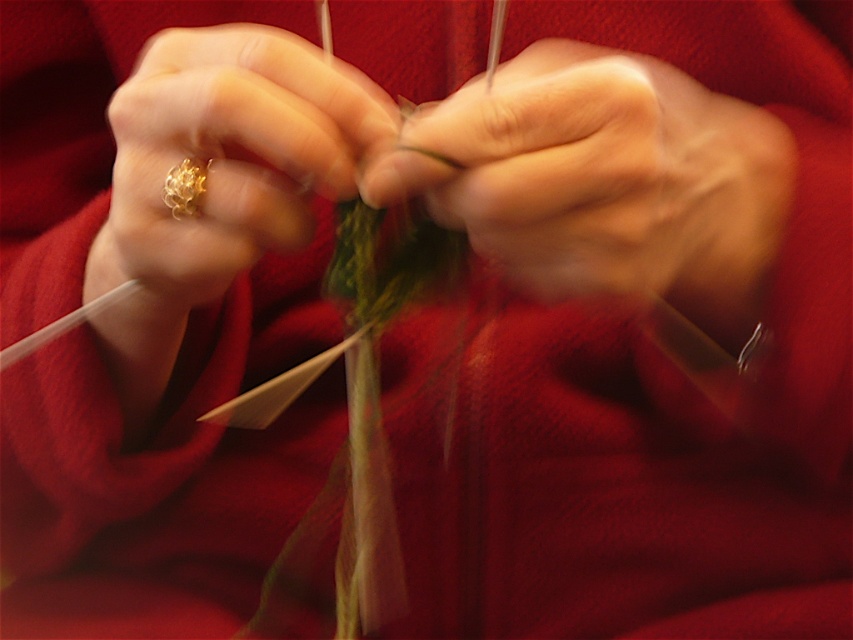
You are a knitter trying to choose between the green yarn at center and the gold textured ring at center to place in a small storage box. Which object can fit into the box if the box is only big enough for the smaller item?

The green yarn at center is smaller than the gold textured ring at center, so it can fit into the box.

You are a photographer trying to capture the gold textured ring at center clearly. Since the green yarn at center is in the way, can you adjust your camera angle to focus on the ring without moving any objects?

The gold textured ring at center is behind the green yarn at center, so adjusting the camera angle to focus on the ring without moving the yarn might be challenging. However, using a smaller aperture or a longer focal length could help isolate the ring and reduce the impact of the yarn in the foreground.